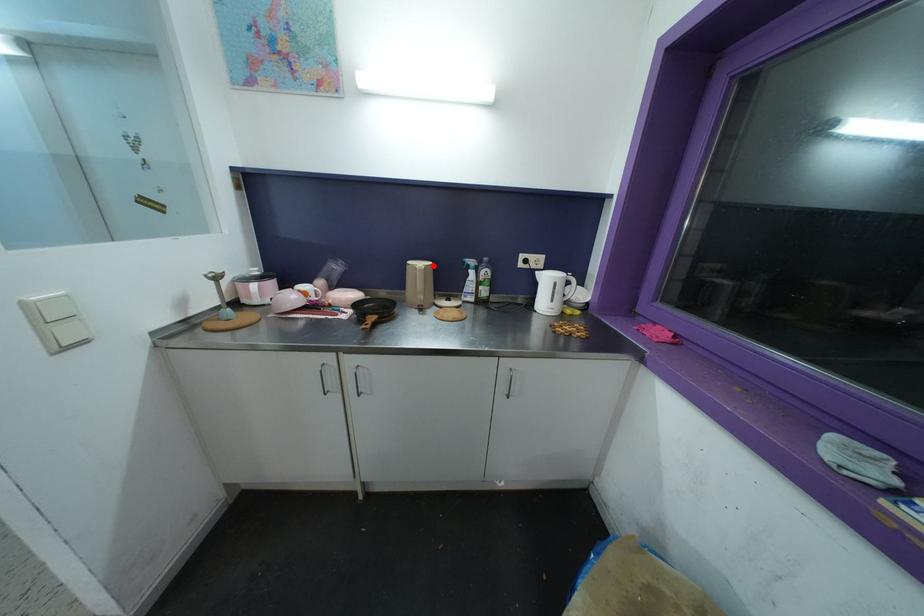
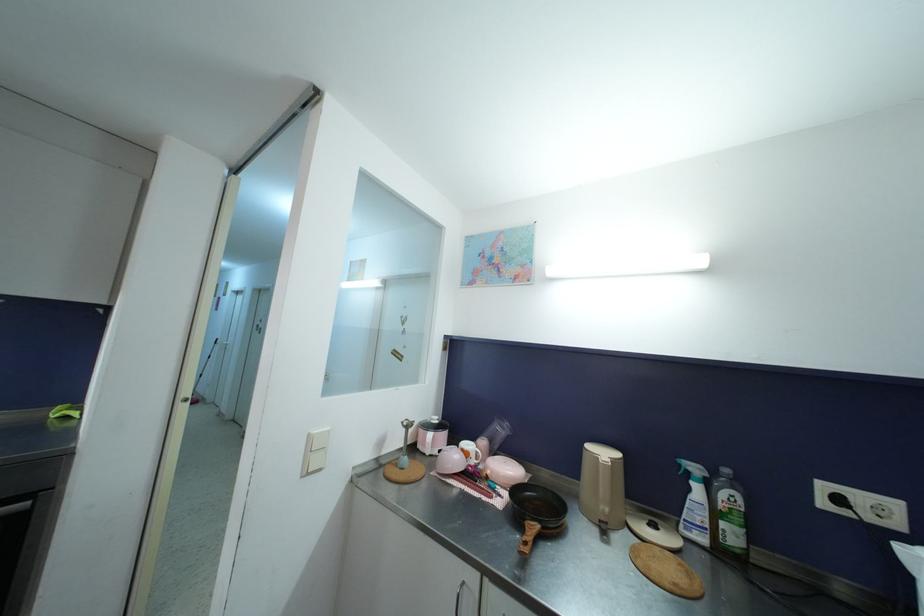
Where in the second image is the point corresponding to the highlighted location from the first image?

(623, 458)